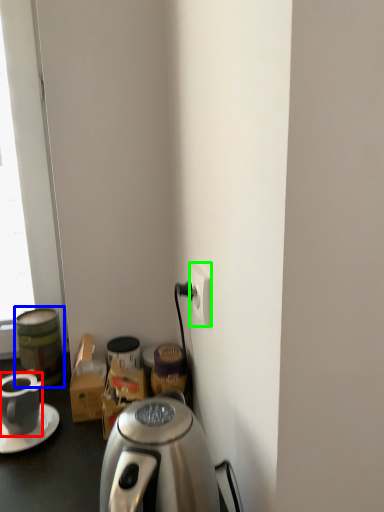
Question: Estimate the real-world distances between objects in this image. Which object is closer to coffee cup (highlighted by a red box), beverage (highlighted by a blue box) or power outlet (highlighted by a green box)?

Choices:
 (A) beverage
 (B) power outlet

Answer: (A)